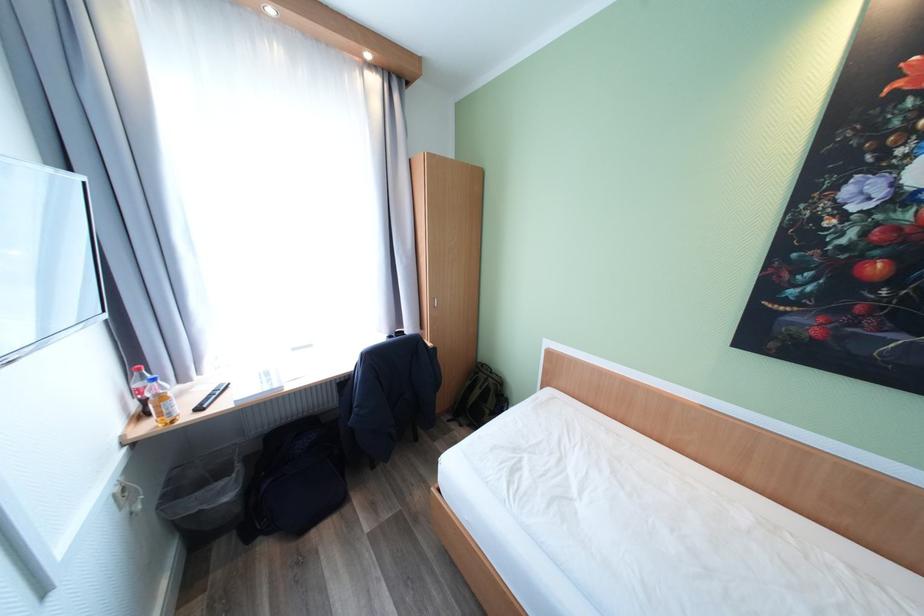
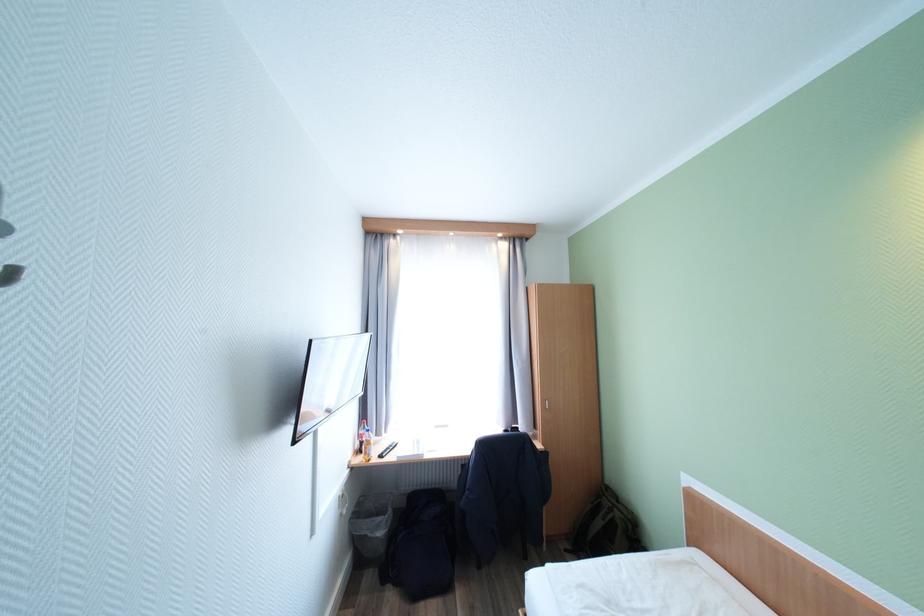
Where in the second image is the point corresponding to [492,378] from the first image?

(617, 506)